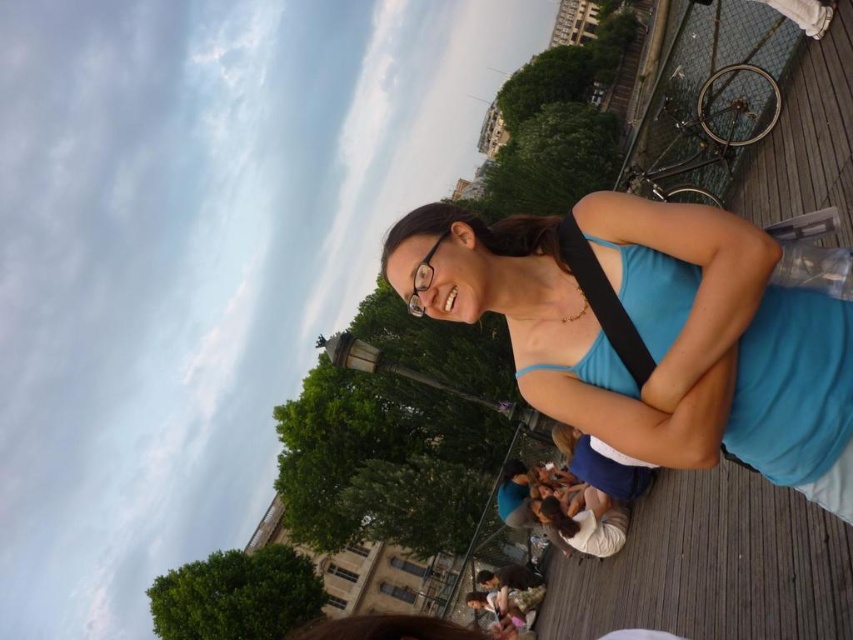
Who is lower down, black fabric strap at upper right or clear plastic glasses at center?

black fabric strap at upper right

Who is more distant from viewer, (570, 216) or (425, 285)?

The point (570, 216) is behind.

I want to click on black fabric strap at upper right, so click(x=602, y=300).

Measure the distance between blue fabric tank top at center and camera.

They are 23.17 meters apart.

Which is more to the left, blue fabric tank top at center or black fabric strap at upper right?

blue fabric tank top at center is more to the left.

Does point (775, 394) come closer to viewer compared to point (628, 333)?

Yes, it is in front of point (628, 333).

This screenshot has height=640, width=853. What are the coordinates of `blue fabric tank top at center` in the screenshot? It's located at (653, 330).

Which is above, blue fabric tank top at center or clear plastic glasses at center?

clear plastic glasses at center is higher up.

Between blue fabric tank top at center and clear plastic glasses at center, which one is positioned lower?

blue fabric tank top at center is below.

Measure the distance between point (799, 380) and camera.

Point (799, 380) and camera are 23.98 meters apart from each other.

I want to click on blue fabric tank top at center, so point(653,330).